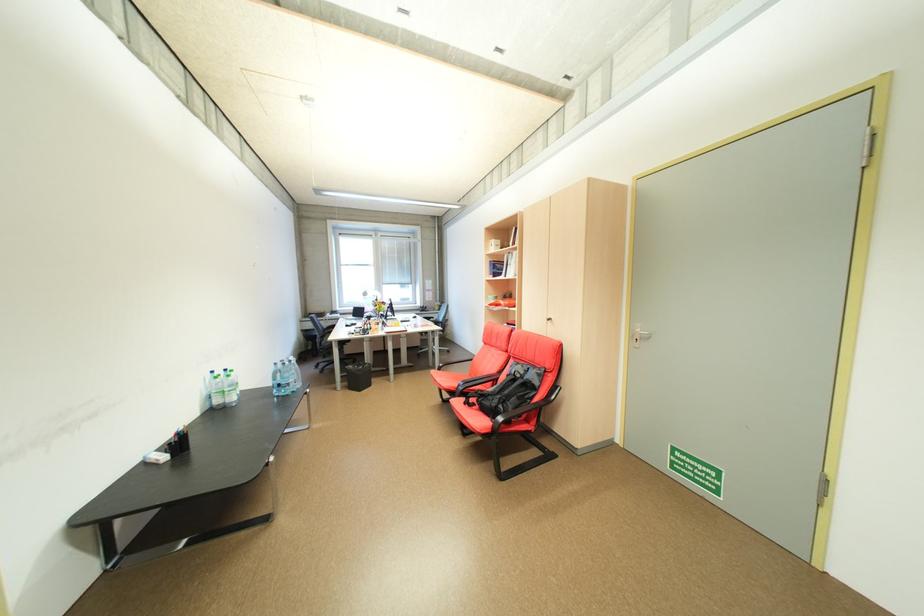
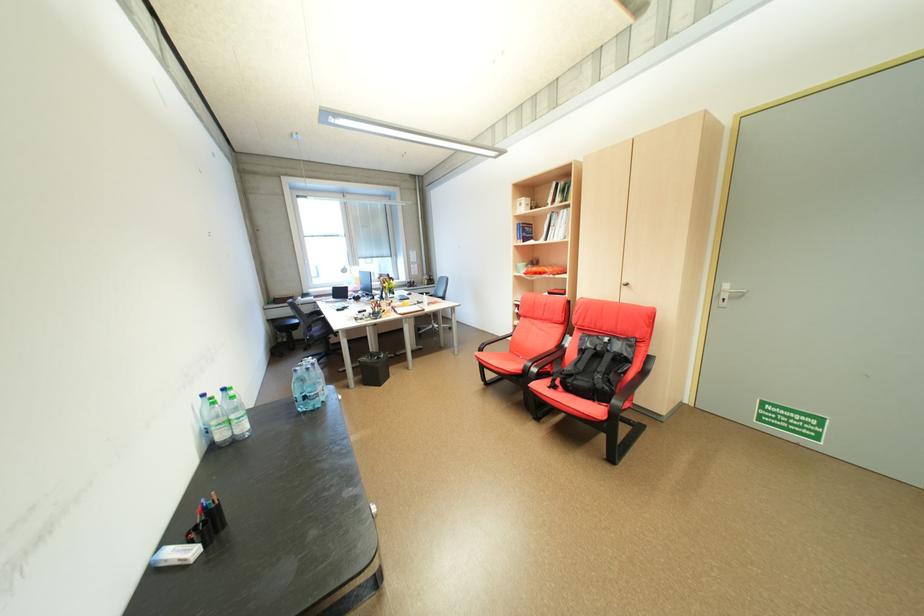
The point at (503, 265) is marked in the first image. Where is the corresponding point in the second image?

(532, 228)